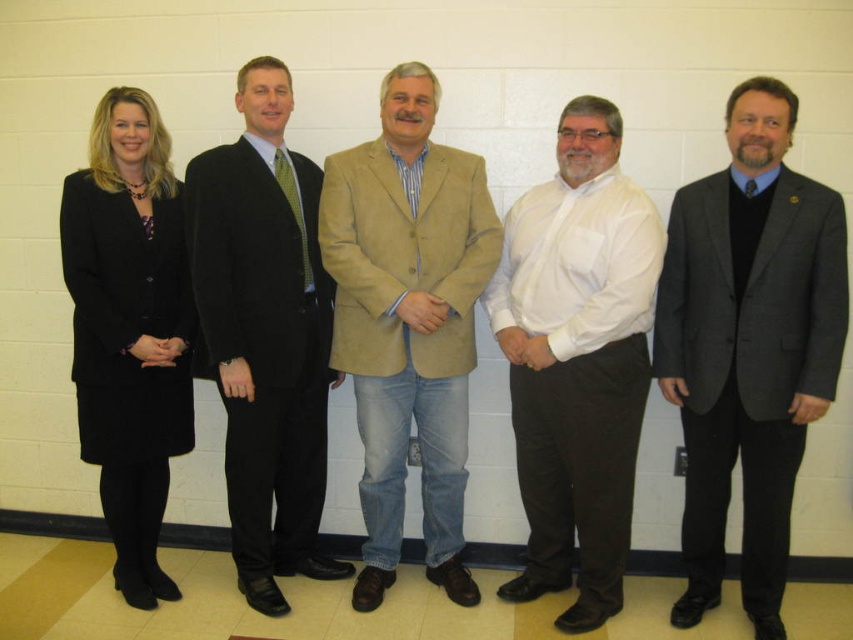
Question: Which point is farther to the camera?

Choices:
 (A) (614, 161)
 (B) (294, 362)

Answer: (B)

Question: Which of the following is the farthest from the observer?

Choices:
 (A) gray wool suit at center
 (B) matte black suit at center

Answer: (B)

Question: Is white shirt at center above tan suede blazer at center?

Choices:
 (A) no
 (B) yes

Answer: (A)

Question: Is matte black suit at center thinner than black fabric suit at left?

Choices:
 (A) yes
 (B) no

Answer: (B)

Question: Which object appears closest to the camera in this image?

Choices:
 (A) white shirt at center
 (B) black fabric suit at left
 (C) matte black suit at center

Answer: (A)

Question: Does white shirt at center come behind matte black suit at center?

Choices:
 (A) no
 (B) yes

Answer: (A)